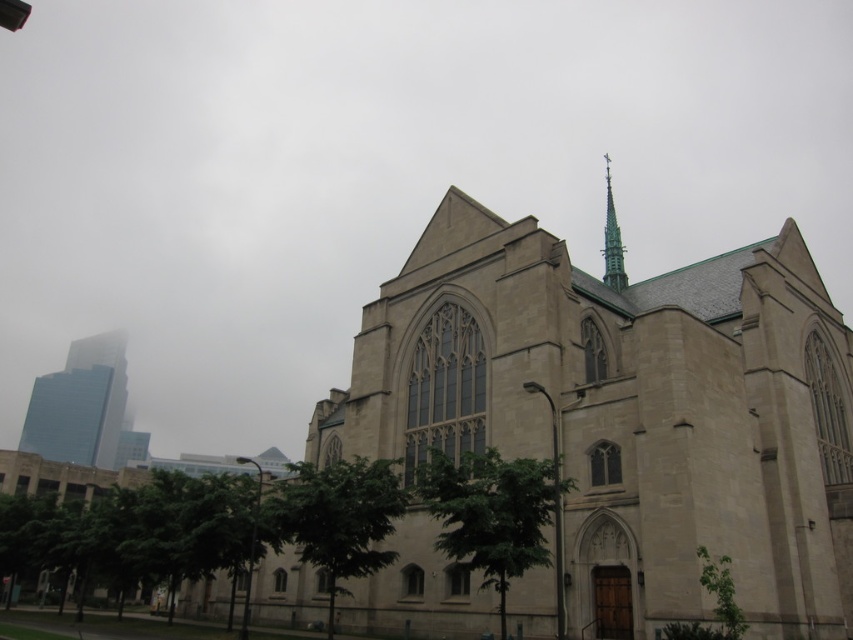
You are a drone operator tasked with flying a drone from the beige stone church at center to the glassy teal skyscraper at left. The drone has a maximum flight range of 150 meters. Can the drone complete this journey without needing to recharge?

The beige stone church at center and glassy teal skyscraper at left are 138.71 meters apart from each other. Since the distance is within the drone operator drone has a maximum flight range of 150 meters, the drone can complete the journey without needing to recharge.

You are a photographer wanting to capture both the beige stone church at center and the glassy teal skyscraper at left in the same frame. Based on their heights, which one should you position closer to the center of your camera frame to ensure both are fully visible?

The beige stone church at center is taller than the glassy teal skyscraper at left, so you should position the beige stone church at center closer to the center of your camera frame to ensure both are fully visible.

You are standing in front of the historic stone church and notice two green leafy trees. Which tree, the green leafy tree at center or the green leafy tree at lower center, is closer to you?

The green leafy tree at center is closer to you because it is positioned in front of the green leafy tree at lower center.